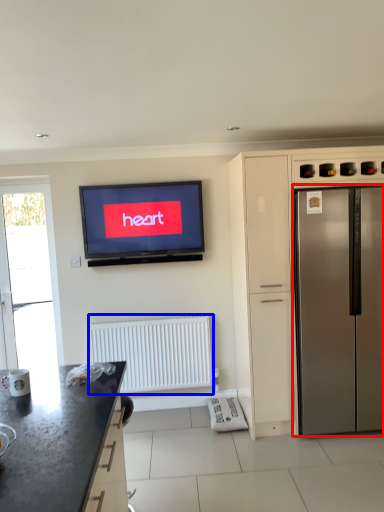
Question: Among these objects, which one is nearest to the camera, refrigerator (highlighted by a red box) or radiator (highlighted by a blue box)?

Choices:
 (A) refrigerator
 (B) radiator

Answer: (A)